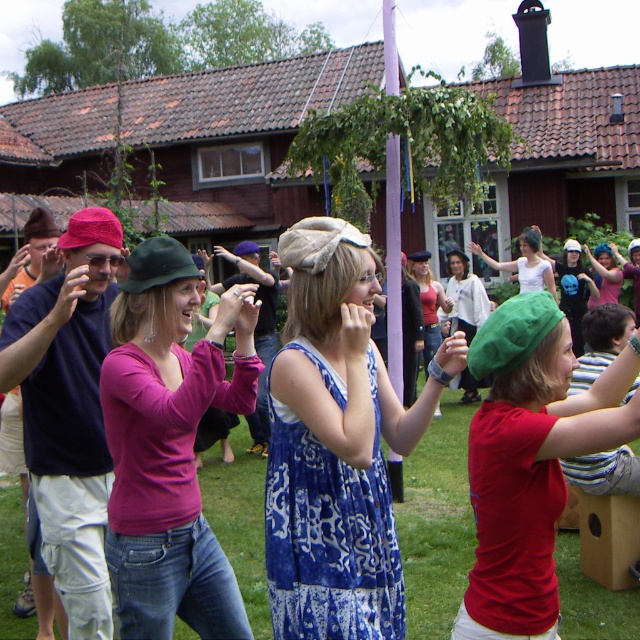
Is point (248, 390) in front of point (465, 531)?

That is True.

Find the location of `matte pink sweater at center`. matte pink sweater at center is located at coordinates (168, 445).

You are a GUI agent. You are given a task and a screenshot of the screen. Output one action in this format:
    pyautogui.click(x=<x>, y=<y>)
    Task: Click on the matte pink sweater at center
    The image size is (640, 640).
    Given the screenshot: What is the action you would take?
    pyautogui.click(x=168, y=445)

Can you confirm if matte red tank top at center is wider than matte pink shirt at center?

No.

Is matte red tank top at center to the left of matte pink shirt at center from the viewer's perspective?

Indeed, matte red tank top at center is positioned on the left side of matte pink shirt at center.

Between point (432, 337) and point (604, 276), which one is positioned in front?

Point (432, 337)

Locate an element on the screen. The image size is (640, 640). matte red tank top at center is located at coordinates (428, 301).

What do you see at coordinates (168, 445) in the screenshot? I see `matte pink sweater at center` at bounding box center [168, 445].

Does matte pink sweater at center appear under white cotton dress at center?

Yes, matte pink sweater at center is below white cotton dress at center.

Which is behind, point (216, 627) or point (524, 237)?

Positioned behind is point (524, 237).

Find the location of a particular element. Image resolution: width=640 pixels, height=640 pixels. matte pink sweater at center is located at coordinates point(168,445).